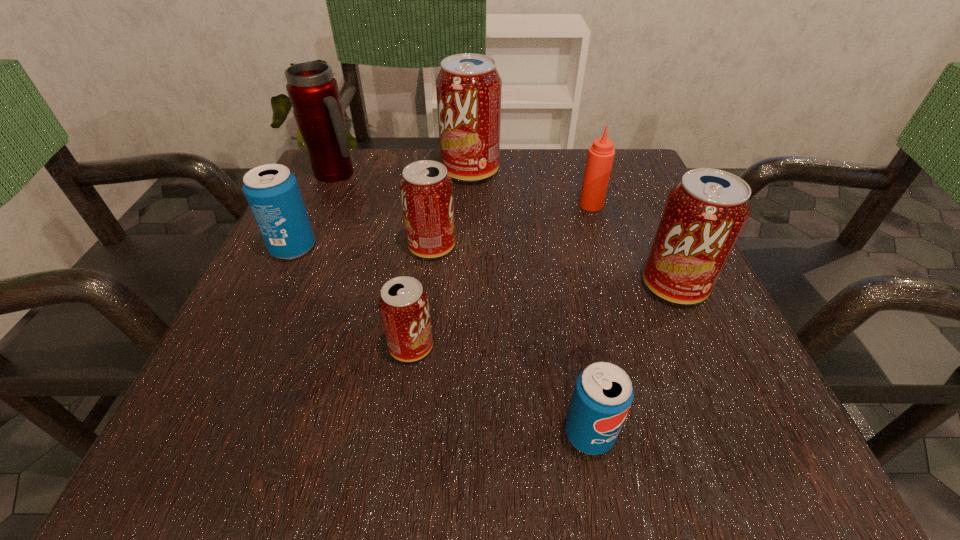
The image size is (960, 540). I want to click on the smallest red soda can, so click(403, 303).

Find the location of `the seventh farthest object`. the seventh farthest object is located at coordinates (403, 303).

At what (x,y) coordinates should I click in order to perform the action: click on the right blue soda can. Please return your answer as a coordinate pair (x, y). Looking at the image, I should click on (603, 394).

Where is `the nearest soda can`? the nearest soda can is located at coordinates (603, 394).

The height and width of the screenshot is (540, 960). Identify the location of vacant space positioned 0.160m on the right of the farthest soda can. (570, 171).

This screenshot has height=540, width=960. Find the location of `free space located on the side with the handle of the thermos bottle`. free space located on the side with the handle of the thermos bottle is located at coordinates (427, 173).

Where is `blank space located on the left of the second biggest red soda can`? This screenshot has height=540, width=960. blank space located on the left of the second biggest red soda can is located at coordinates (545, 286).

The width and height of the screenshot is (960, 540). Identify the location of vacant space located 0.110m on the back of the Tabasco sauce. (580, 171).

This screenshot has height=540, width=960. I want to click on free spot located on the back of the third biggest red soda can, so click(x=438, y=196).

You are a GUI agent. You are given a task and a screenshot of the screen. Output one action in this format:
    pyautogui.click(x=<x>, y=<y>)
    Task: Click on the vacant space located on the right of the left blue soda can
    Image resolution: width=960 pixels, height=540 pixels.
    Given the screenshot: What is the action you would take?
    pyautogui.click(x=475, y=248)